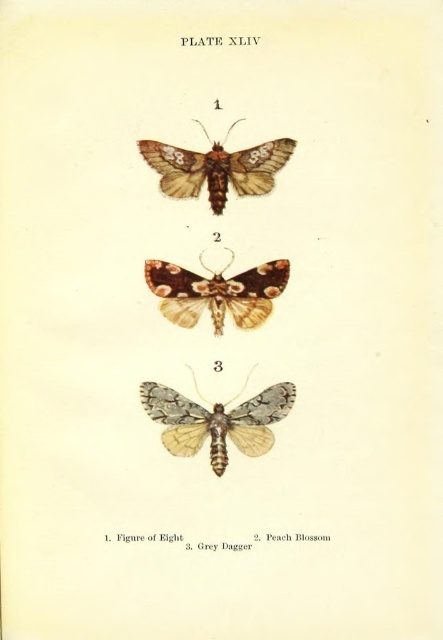
How distant is brown speckled moth at center from brown textured moth at upper center?

brown speckled moth at center is 6.88 inches away from brown textured moth at upper center.

Between brown speckled moth at center and brown textured moth at upper center, which one appears on the right side from the viewer's perspective?

brown speckled moth at center

Where is `brown speckled moth at center`? Image resolution: width=443 pixels, height=640 pixels. brown speckled moth at center is located at coordinates (217, 292).

Does speckled gray moth at center have a lesser height compared to brown speckled moth at center?

Incorrect, speckled gray moth at center's height does not fall short of brown speckled moth at center's.

I want to click on speckled gray moth at center, so click(x=217, y=420).

Where is `speckled gray moth at center`? speckled gray moth at center is located at coordinates (217, 420).

Which is behind, point (212, 460) or point (185, 154)?

Positioned behind is point (212, 460).

Between speckled gray moth at center and brown textured moth at upper center, which one has less height?

brown textured moth at upper center

Where is `speckled gray moth at center`? speckled gray moth at center is located at coordinates (217, 420).

Locate an element on the screen. The width and height of the screenshot is (443, 640). speckled gray moth at center is located at coordinates (217, 420).